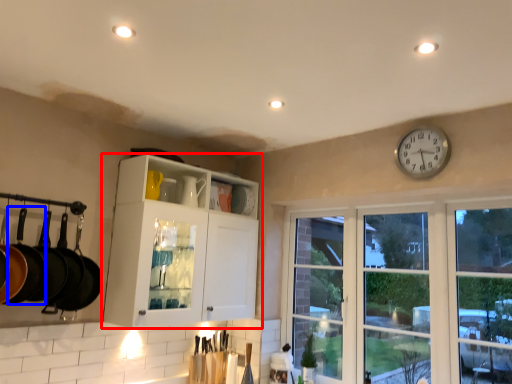
Question: Which point is closer to the camera, cabinetry (highlighted by a red box) or frying pan (highlighted by a blue box)?

Choices:
 (A) cabinetry
 (B) frying pan

Answer: (B)